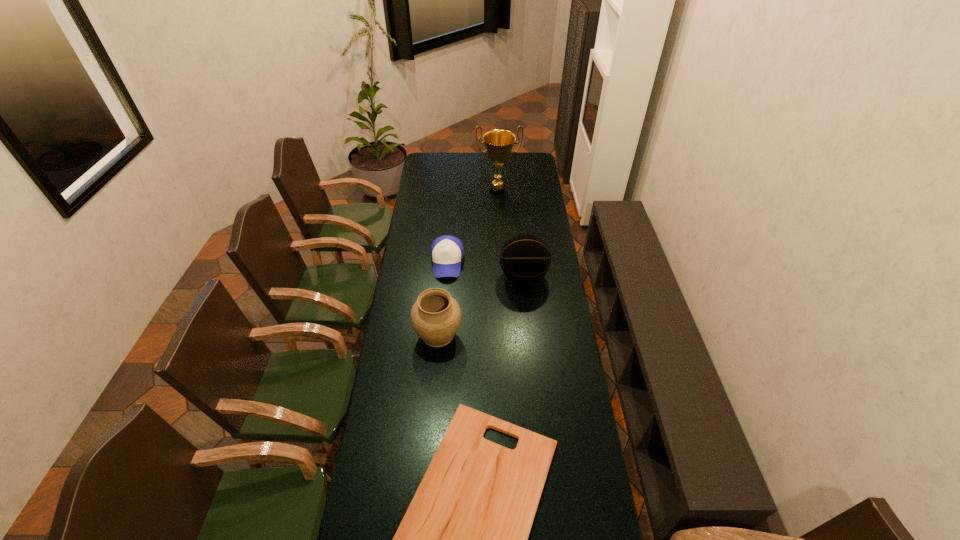
Choose which object is the fourth nearest neighbor to the fourth farthest object. Please provide its 2D coordinates. Your answer should be formatted as a tuple, i.e. [(x, y)], where the tuple contains the x and y coordinates of a point satisfying the conditions above.

[(498, 143)]

Select which object is the closest to the fourth farthest object. Please provide its 2D coordinates. Your answer should be formatted as a tuple, i.e. [(x, y)], where the tuple contains the x and y coordinates of a point satisfying the conditions above.

[(525, 258)]

The height and width of the screenshot is (540, 960). I want to click on vacant space that satisfies the following two spatial constraints: 1. on the front-facing side of the baseball cap; 2. on the left side of the basketball, so click(445, 277).

This screenshot has height=540, width=960. Find the location of `vacant space that satisfies the following two spatial constraints: 1. on the front view with handles of the tallest object; 2. on the left side of the basketball`. vacant space that satisfies the following two spatial constraints: 1. on the front view with handles of the tallest object; 2. on the left side of the basketball is located at coordinates (502, 277).